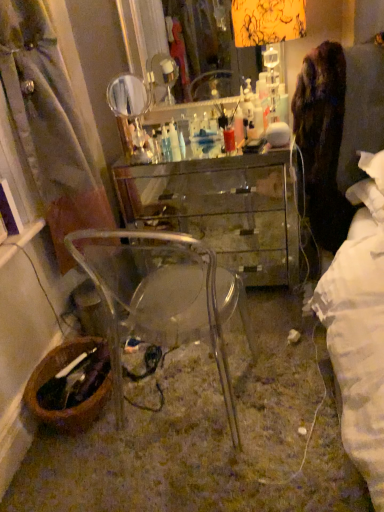
This screenshot has width=384, height=512. I want to click on transparent plastic chair at lower center, so click(x=169, y=306).

Measure the distance between point (77, 418) and camera.

Point (77, 418) and camera are 1.51 meters apart.

The height and width of the screenshot is (512, 384). What do you see at coordinates (203, 111) in the screenshot?
I see `clear glass mirror at upper center` at bounding box center [203, 111].

Identify the location of transparent plastic chair at lower center. (169, 306).

Considering the relative positions of brown woven picnic basket at lower left and transparent glass desk at center in the image provided, is brown woven picnic basket at lower left to the left of transparent glass desk at center from the viewer's perspective?

Correct, you'll find brown woven picnic basket at lower left to the left of transparent glass desk at center.

Is brown woven picnic basket at lower left bigger than transparent glass desk at center?

No, brown woven picnic basket at lower left is not bigger than transparent glass desk at center.

From a real-world perspective, which object rests below the other?

In real-world perspective, brown woven picnic basket at lower left is lower.

Can transparent glass desk at center be found inside brown woven picnic basket at lower left?

No, transparent glass desk at center is located outside of brown woven picnic basket at lower left.

Is clear glass mirror at upper center positioned with its back to brown woven picnic basket at lower left?

clear glass mirror at upper center does not have its back to brown woven picnic basket at lower left.

How distant is clear glass mirror at upper center from brown woven picnic basket at lower left?

They are 1.17 meters apart.

Is clear glass mirror at upper center not close to brown woven picnic basket at lower left?

clear glass mirror at upper center is far away from brown woven picnic basket at lower left.

Which is more to the right, clear glass mirror at upper center or brown woven picnic basket at lower left?

clear glass mirror at upper center.

Which is behind, transparent glass desk at center or transparent plastic chair at lower center?

transparent glass desk at center is further from the camera.

From the image's perspective, is transparent glass desk at center on transparent plastic chair at lower center?

Yes, from the image's perspective, transparent glass desk at center is above transparent plastic chair at lower center.

Based on the photo, how far apart are transparent glass desk at center and transparent plastic chair at lower center?

97.11 centimeters.

Looking at this image, which is farther, [217,358] or [269,248]?

The point [269,248] is more distant.

Considering the sizes of objects transparent plastic chair at lower center and transparent glass desk at center in the image provided, who is smaller, transparent plastic chair at lower center or transparent glass desk at center?

transparent plastic chair at lower center is smaller.

From a real-world perspective, which object rests below the other?

transparent glass desk at center is physically lower.

Is transparent glass desk at center surrounded by transparent plastic chair at lower center?

Actually, transparent glass desk at center is outside transparent plastic chair at lower center.

Is clear glass mirror at upper center a part of transparent plastic chair at lower center?

No.

Image resolution: width=384 pixels, height=512 pixels. What are the coordinates of `chair on the left of the clear glass mirror at upper center` in the screenshot? It's located at (169, 306).

Is point (169, 326) more distant than point (196, 132)?

No, (169, 326) is in front of (196, 132).

Is transparent plastic chair at lower center oriented towards clear glass mirror at upper center?

Yes.

Which is more to the left, transparent glass desk at center or brown woven picnic basket at lower left?

brown woven picnic basket at lower left is more to the left.

From a real-world perspective, is transparent glass desk at center over brown woven picnic basket at lower left?

Yes.

Is transparent glass desk at center far away from brown woven picnic basket at lower left?

Yes, transparent glass desk at center is far from brown woven picnic basket at lower left.

Is brown woven picnic basket at lower left at the back of transparent glass desk at center?

No.

Is clear glass mirror at upper center situated inside transparent glass desk at center or outside?

clear glass mirror at upper center is not enclosed by transparent glass desk at center.

Is there a large distance between clear glass mirror at upper center and transparent glass desk at center?

No, clear glass mirror at upper center is not far away from transparent glass desk at center.

How many degrees apart are the facing directions of clear glass mirror at upper center and transparent glass desk at center?

clear glass mirror at upper center and transparent glass desk at center are facing 0.00437 degrees away from each other.

Find the location of `desk located underneath the clear glass mirror at upper center (from a real-world perspective)`. desk located underneath the clear glass mirror at upper center (from a real-world perspective) is located at coordinates (222, 209).

Locate an element on the screen. desk above the brown woven picnic basket at lower left (from a real-world perspective) is located at coordinates (222, 209).

In order to click on picnic basket below the clear glass mirror at upper center (from a real-world perspective) in this screenshot , I will do `click(53, 375)`.

Looking at the image, which one is located closer to transparent glass desk at center, brown woven picnic basket at lower left or transparent plastic chair at lower center?

transparent plastic chair at lower center is closer to transparent glass desk at center.

Which object lies nearer to the anchor point clear glass mirror at upper center, transparent plastic chair at lower center or transparent glass desk at center?

Based on the image, transparent glass desk at center appears to be nearer to clear glass mirror at upper center.

Estimate the real-world distances between objects in this image. Which object is closer to transparent plastic chair at lower center, brown woven picnic basket at lower left or clear glass mirror at upper center?

brown woven picnic basket at lower left.

When comparing their distances from brown woven picnic basket at lower left, does transparent plastic chair at lower center or transparent glass desk at center seem closer?

The object closer to brown woven picnic basket at lower left is transparent plastic chair at lower center.

From the image, which object appears to be farther from transparent plastic chair at lower center, brown woven picnic basket at lower left or transparent glass desk at center?

transparent glass desk at center is further to transparent plastic chair at lower center.

Considering their positions, is transparent plastic chair at lower center positioned further to clear glass mirror at upper center than brown woven picnic basket at lower left?

brown woven picnic basket at lower left is further to clear glass mirror at upper center.

Considering their positions, is transparent glass desk at center positioned closer to transparent plastic chair at lower center than brown woven picnic basket at lower left?

Based on the image, brown woven picnic basket at lower left appears to be nearer to transparent plastic chair at lower center.

Based on their spatial positions, is clear glass mirror at upper center or transparent plastic chair at lower center closer to transparent glass desk at center?

clear glass mirror at upper center lies closer to transparent glass desk at center than the other object.

What are the coordinates of `desk between clear glass mirror at upper center and transparent plastic chair at lower center in the vertical direction` in the screenshot? It's located at (222, 209).

Where is `desk between clear glass mirror at upper center and brown woven picnic basket at lower left from top to bottom`? The height and width of the screenshot is (512, 384). desk between clear glass mirror at upper center and brown woven picnic basket at lower left from top to bottom is located at coordinates (222, 209).

Where is `chair between clear glass mirror at upper center and brown woven picnic basket at lower left in the vertical direction`? chair between clear glass mirror at upper center and brown woven picnic basket at lower left in the vertical direction is located at coordinates (169, 306).

This screenshot has height=512, width=384. I want to click on picnic basket located between transparent plastic chair at lower center and transparent glass desk at center in the depth direction, so click(53, 375).